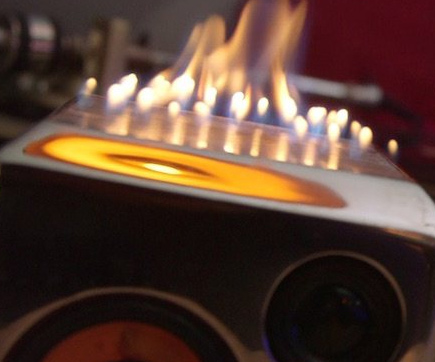
At what (x,y) coordinates should I click in order to perform the action: click on 2 different materials used for table. Please return your answer as a coordinate pair (x, y). This screenshot has height=362, width=435. Looking at the image, I should click on (376, 212), (366, 158).